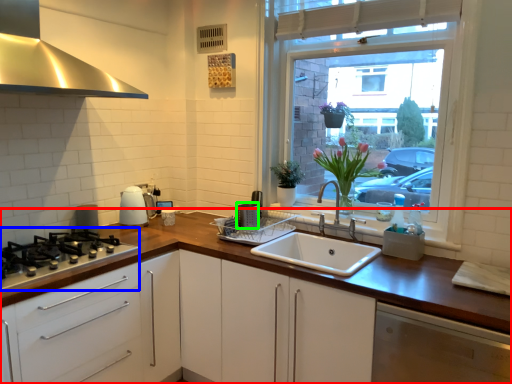
Question: Which is farther away from countertop (highlighted by a red box)? gas stove (highlighted by a blue box) or appliance (highlighted by a green box)?

Choices:
 (A) gas stove
 (B) appliance

Answer: (B)